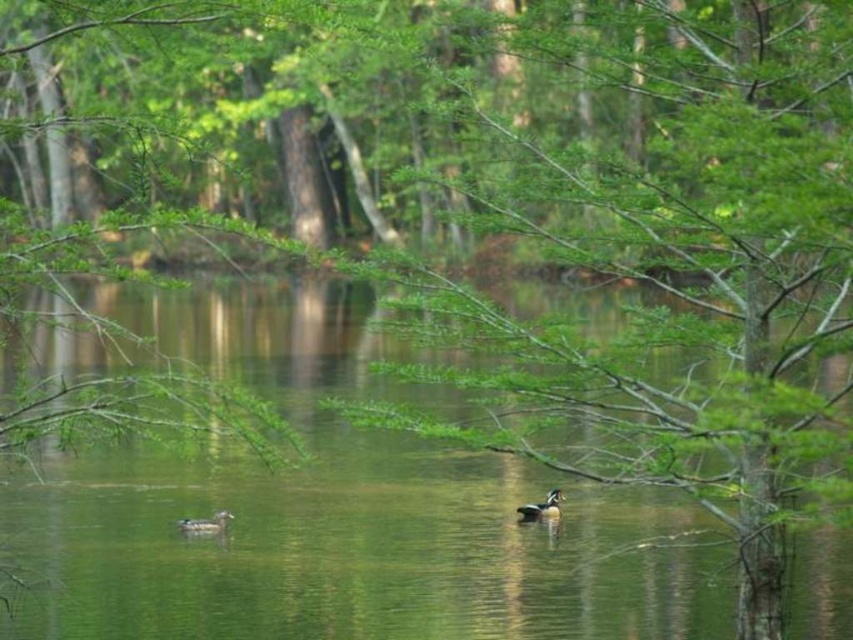
You are standing on the lakeside and want to throw a small stone into the water. If you aim for the shiny brown duck at center, will the green water at center be higher than the duck when the stone hits the water?

The green water at center is much taller than the shiny brown duck at center, so when you throw the stone, the water will indeed be higher than the duck at the point of impact.

You are standing at the edge of the lake and want to locate the green water at center. Based on the coordinates provided, where exactly would you find it?

The green water at center is located at coordinates point (337,509).

You are standing at the edge of the water and want to toss a small pebble so it lands as close as possible to the shiny brown duck at lower left without hitting it. Considering the green water at center is between you and the duck, where should you aim?

The green water at center is closer to the viewer than the shiny brown duck at lower left, so you should aim beyond the green water at center towards the shiny brown duck at lower left to ensure the pebble reaches the duck without hitting the water first.